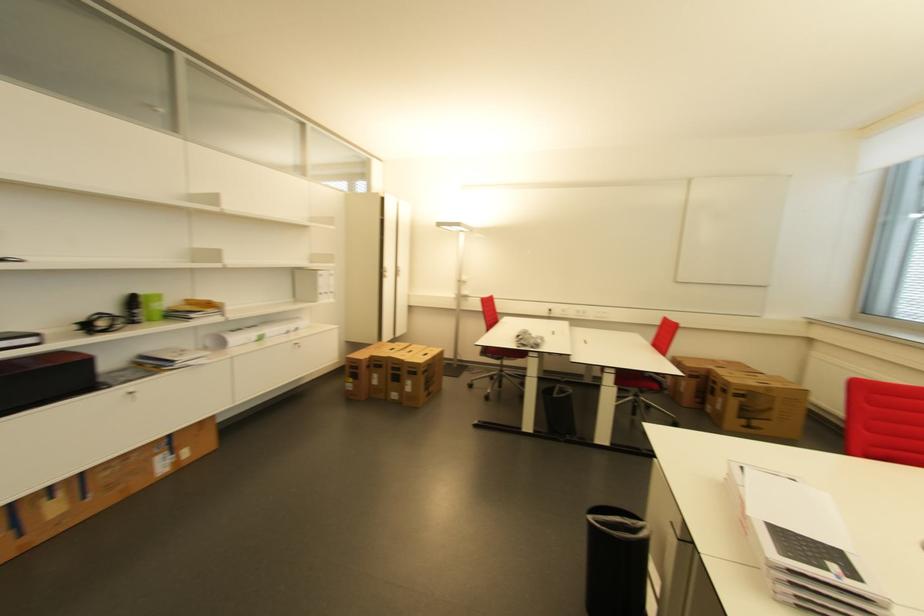
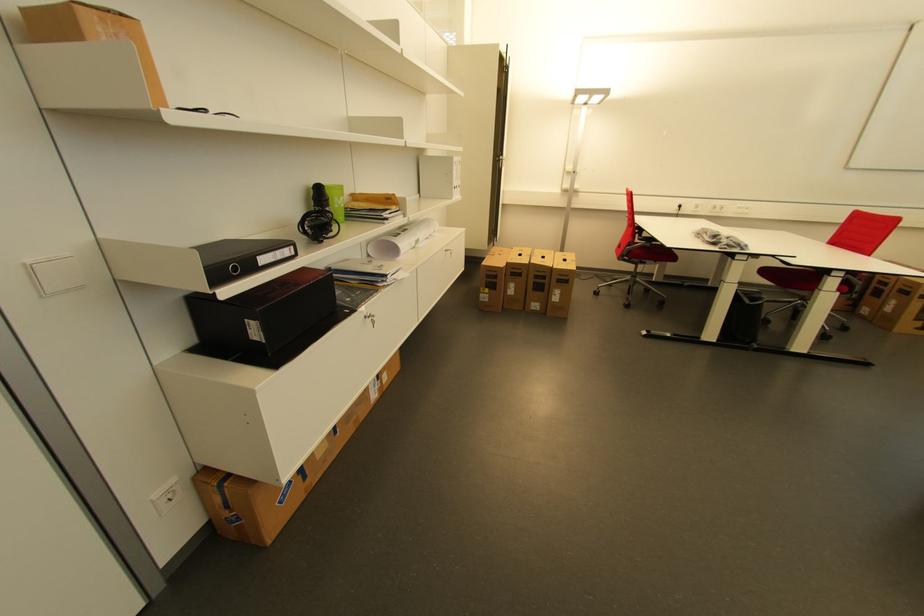
Where in the second image is the point corresponding to pixel 405 371 from the first image?

(550, 278)